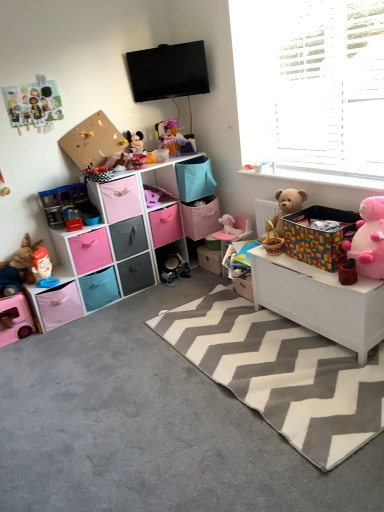
The height and width of the screenshot is (512, 384). Describe the element at coordinates (318, 236) in the screenshot. I see `multicolored fabric storage box at right, which is the fourth storage box in left-to-right order` at that location.

What is the approximate width of matte plastic mickey mouse at center, arranged as the third toy when viewed from the right?

5.46 inches.

Describe the element at coordinates (107, 248) in the screenshot. This screenshot has width=384, height=512. I see `pink fabric storage cubes at left` at that location.

This screenshot has height=512, width=384. What do you see at coordinates (210, 260) in the screenshot? I see `matte cardboard box at center, which is the 3th storage box in left-to-right order` at bounding box center [210, 260].

The image size is (384, 512). What do you see at coordinates (136, 273) in the screenshot?
I see `pink fabric drawer at center, placed as the 5th drawer when sorted from top to bottom` at bounding box center [136, 273].

Image resolution: width=384 pixels, height=512 pixels. What do you see at coordinates (18, 268) in the screenshot?
I see `matte plastic toy at left, the second toy positioned from the left` at bounding box center [18, 268].

Locate an element on the screen. multicolored fabric storage box at right, placed as the first storage box when sorted from right to left is located at coordinates (318, 236).

From a real-world perspective, between pink plush bear at center, which is the first toy in right-to-left order, and pink plastic toy car at lower left, positioned as the 1th toy in left-to-right order, who is vertically higher?

pink plush bear at center, which is the first toy in right-to-left order, from a real-world perspective.

Can you confirm if pink plush bear at center, which is the first toy in right-to-left order, is bigger than pink plastic toy car at lower left, positioned as the 1th toy in left-to-right order?

Actually, pink plush bear at center, which is the first toy in right-to-left order, might be smaller than pink plastic toy car at lower left, positioned as the 1th toy in left-to-right order.

Which of these two, pink plush bear at center, which is the first toy in right-to-left order, or pink plastic toy car at lower left, the seventh toy positioned from the right, stands shorter?

Standing shorter between the two is pink plush bear at center, which is the first toy in right-to-left order.

Is pink plush bear at center, which is the first toy in right-to-left order, at the left side of pink plastic toy car at lower left, positioned as the 1th toy in left-to-right order?

No.

From a real-world perspective, between pink fabric storage box at center, the 3th storage box when ordered from right to left, and pink plastic toy car at lower left, positioned as the 1th toy in left-to-right order, who is vertically lower?

pink plastic toy car at lower left, positioned as the 1th toy in left-to-right order.

From the picture: Is pink fabric storage box at center, the 3th storage box when ordered from right to left, facing away from pink plastic toy car at lower left, the seventh toy positioned from the right?

No, pink fabric storage box at center, the 3th storage box when ordered from right to left,'s orientation is not away from pink plastic toy car at lower left, the seventh toy positioned from the right.

Is pink fabric storage box at center, the 2th storage box when ordered from left to right, next to pink plastic toy car at lower left, the seventh toy positioned from the right?

No, pink fabric storage box at center, the 2th storage box when ordered from left to right, is not making contact with pink plastic toy car at lower left, the seventh toy positioned from the right.

Looking at the image, does matte black drawer at center, the 3th drawer viewed from the top, seem bigger or smaller compared to pink fabric drawer at left, which is the fourth drawer in top-to-bottom order?

Clearly, matte black drawer at center, the 3th drawer viewed from the top, is smaller in size than pink fabric drawer at left, which is the fourth drawer in top-to-bottom order.

Based on the photo, considering the sizes of objects matte black drawer at center, placed as the fourth drawer when sorted from bottom to top, and pink fabric drawer at left, which is the fourth drawer in top-to-bottom order, in the image provided, who is wider, matte black drawer at center, placed as the fourth drawer when sorted from bottom to top, or pink fabric drawer at left, which is the fourth drawer in top-to-bottom order,?

pink fabric drawer at left, which is the fourth drawer in top-to-bottom order.

Does matte black drawer at center, the 3th drawer viewed from the top, come behind pink fabric drawer at left, placed as the 3th drawer when sorted from bottom to top?

Yes, the depth of matte black drawer at center, the 3th drawer viewed from the top, is greater than that of pink fabric drawer at left, placed as the 3th drawer when sorted from bottom to top.

Is matte black drawer at center, placed as the fourth drawer when sorted from bottom to top, with pink fabric drawer at left, which is the fourth drawer in top-to-bottom order?

matte black drawer at center, placed as the fourth drawer when sorted from bottom to top, and pink fabric drawer at left, which is the fourth drawer in top-to-bottom order, are not in contact.

From a real-world perspective, does pink fabric storage box at lower left, arranged as the first storage box when viewed from the left, stand above matte plastic mickey mouse at center, the fifth toy viewed from the left?

No, from a real-world perspective, pink fabric storage box at lower left, arranged as the first storage box when viewed from the left, is not over matte plastic mickey mouse at center, the fifth toy viewed from the left

Can you see pink fabric storage box at lower left, arranged as the first storage box when viewed from the left, touching matte plastic mickey mouse at center, arranged as the third toy when viewed from the right?

No, pink fabric storage box at lower left, arranged as the first storage box when viewed from the left, is not in contact with matte plastic mickey mouse at center, arranged as the third toy when viewed from the right.

Does point (49, 313) come closer to viewer compared to point (136, 131)?

That is True.

Considering the relative sizes of matte black drawer at center, the 3th drawer viewed from the top, and pink fabric storage cubes at left in the image provided, is matte black drawer at center, the 3th drawer viewed from the top, thinner than pink fabric storage cubes at left?

No.

Are matte black drawer at center, placed as the fourth drawer when sorted from bottom to top, and pink fabric storage cubes at left making contact?

matte black drawer at center, placed as the fourth drawer when sorted from bottom to top, and pink fabric storage cubes at left are not in contact.

Based on their sizes in the image, would you say matte black drawer at center, placed as the fourth drawer when sorted from bottom to top, is bigger or smaller than pink fabric storage cubes at left?

Considering their sizes, matte black drawer at center, placed as the fourth drawer when sorted from bottom to top, takes up less space than pink fabric storage cubes at left.

Does matte black drawer at center, the 3th drawer viewed from the top, turn towards pink fabric storage cubes at left?

Yes, matte black drawer at center, the 3th drawer viewed from the top, is turned towards pink fabric storage cubes at left.

From the picture: Does matte plastic toy at left, which is the sixth toy from right to left, appear on the right side of matte plastic toy at lower left, which is the 4th toy from right to left?

Incorrect, matte plastic toy at left, which is the sixth toy from right to left, is not on the right side of matte plastic toy at lower left, which is the 4th toy from right to left.

Can you confirm if matte plastic toy at left, the second toy positioned from the left, is bigger than matte plastic toy at lower left, which is the 4th toy from right to left?

Yes.

Find the location of a particular element. This screenshot has width=384, height=512. toy that is the 1st one when counting downward from the matte plastic toy at left, the second toy positioned from the left (from the image's perspective) is located at coordinates (43, 269).

Is matte plastic toy at left, which is the sixth toy from right to left, surrounding matte plastic toy at lower left, which appears as the fourth toy when viewed from the left?

Indeed, matte plastic toy at lower left, which appears as the fourth toy when viewed from the left, is located within matte plastic toy at left, which is the sixth toy from right to left.

Would you consider pink fabric drawer at center, positioned as the second drawer in bottom-to-top order, to be distant from pink fabric drawer at lower left, positioned as the 6th drawer in top-to-bottom order?

No, pink fabric drawer at center, positioned as the second drawer in bottom-to-top order, is not far away from pink fabric drawer at lower left, positioned as the 6th drawer in top-to-bottom order.

Is pink fabric drawer at center, placed as the 5th drawer when sorted from top to bottom, closer to the viewer compared to pink fabric drawer at lower left, the 1th drawer positioned from the bottom?

No.

Is pink fabric drawer at center, positioned as the second drawer in bottom-to-top order, surrounding pink fabric drawer at lower left, the 1th drawer positioned from the bottom?

That's incorrect, pink fabric drawer at lower left, the 1th drawer positioned from the bottom, is not inside pink fabric drawer at center, positioned as the second drawer in bottom-to-top order.

Does pink fabric drawer at center, positioned as the second drawer in bottom-to-top order, have a smaller size compared to pink fabric drawer at lower left, the 1th drawer positioned from the bottom?

Yes, pink fabric drawer at center, positioned as the second drawer in bottom-to-top order, is smaller than pink fabric drawer at lower left, the 1th drawer positioned from the bottom.

From the image's perspective, count 3rd toys downward from the pink plush bear at center, which is the first toy in right-to-left order, and point to it. Please provide its 2D coordinates.

[(15, 318)]

Starting from the pink fabric storage box at center, the 2th storage box when ordered from left to right, which toy is the 4th one in front? Please provide its 2D coordinates.

[(15, 318)]

From the image, which object appears to be nearer to paper cutouts at upper left, which is the third toy in left-to-right order, pink plush teddy bear at right, which is counted as the 2th teddy bear, starting from the back, or matte plastic toy at lower left, which is the 4th toy from right to left?

matte plastic toy at lower left, which is the 4th toy from right to left, is positioned closer to the anchor paper cutouts at upper left, which is the third toy in left-to-right order.

Looking at the image, which one is located closer to matte plastic toy at lower left, which is the 4th toy from right to left, pink plush bear at center, arranged as the seventh toy when viewed from the left, or gray carpet at lower left?

gray carpet at lower left is positioned closer to the anchor matte plastic toy at lower left, which is the 4th toy from right to left.

When comparing their distances from pink plush bear at center, arranged as the seventh toy when viewed from the left, does gray chevron rug at center or matte plastic toy at left, the second toy positioned from the left, seem further?

matte plastic toy at left, the second toy positioned from the left, is further to pink plush bear at center, arranged as the seventh toy when viewed from the left.

When comparing their distances from pink plush bear at center, which is the first toy in right-to-left order, does pink plush teddy bear at right, which is counted as the 2th teddy bear, starting from the back, or matte cardboard box at center, which is counted as the 2th storage box, starting from the right, seem closer?

matte cardboard box at center, which is counted as the 2th storage box, starting from the right.

When comparing their distances from pink plastic toy car at lower left, positioned as the 1th toy in left-to-right order, does gray carpet at lower left or pink fabric drawer at center, which is counted as the fifth drawer, starting from the bottom, seem closer?

gray carpet at lower left lies closer to pink plastic toy car at lower left, positioned as the 1th toy in left-to-right order, than the other object.

Looking at the image, which one is located closer to pink plush bear at center, which is the first toy in right-to-left order, fluffy beige teddy bear at right, placed as the first teddy bear when sorted from left to right, or pink fabric drawer at center, acting as the 2th drawer starting from the top?

The object closer to pink plush bear at center, which is the first toy in right-to-left order, is pink fabric drawer at center, acting as the 2th drawer starting from the top.

Looking at this image, based on their spatial positions, is white wood toy box at lower right or matte plastic toy at left, which is the sixth toy from right to left, further from matte plastic mickey mouse at center, arranged as the third toy when viewed from the right?

white wood toy box at lower right is positioned further to the anchor matte plastic mickey mouse at center, arranged as the third toy when viewed from the right.

Based on their spatial positions, is matte plastic toy at left, which is the sixth toy from right to left, or pink fabric drawer at center, placed as the 5th drawer when sorted from top to bottom, further from pink fabric drawer at left, placed as the 3th drawer when sorted from bottom to top?

The object further to pink fabric drawer at left, placed as the 3th drawer when sorted from bottom to top, is matte plastic toy at left, which is the sixth toy from right to left.

Image resolution: width=384 pixels, height=512 pixels. I want to click on table located between gray carpet at lower left and pink fabric drawer at center, placed as the 5th drawer when sorted from top to bottom, in the depth direction, so click(320, 300).

Locate an element on the screen. The height and width of the screenshot is (512, 384). mat between pink fabric storage cubes at left and multicolored fabric storage box at right, which is the fourth storage box in left-to-right order, from left to right is located at coordinates (282, 372).

You are a GUI agent. You are given a task and a screenshot of the screen. Output one action in this format:
    pyautogui.click(x=<x>, y=<y>)
    Task: Click on the mat between matte black drawer at center, the 3th drawer viewed from the top, and pink plush teddy bear at right, which is counted as the 2th teddy bear, starting from the back
    The image size is (384, 512).
    Given the screenshot: What is the action you would take?
    pyautogui.click(x=282, y=372)

At what (x,y) coordinates should I click in order to perform the action: click on concrete situated between paper cutouts at upper left, the fifth toy from the right, and multicolored fabric storage box at right, placed as the first storage box when sorted from right to left, from left to right. Please return your answer as a coordinate pair (x, y). Image resolution: width=384 pixels, height=512 pixels. Looking at the image, I should click on (150, 426).